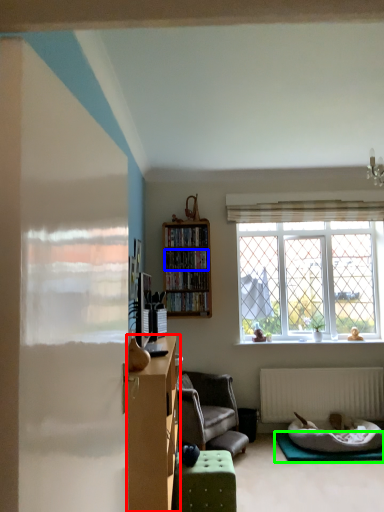
Question: Which object is positioned closest to cabinetry (highlighted by a red box)? Select from cabinet (highlighted by a blue box) and yoga mat (highlighted by a green box).

Choices:
 (A) cabinet
 (B) yoga mat

Answer: (B)